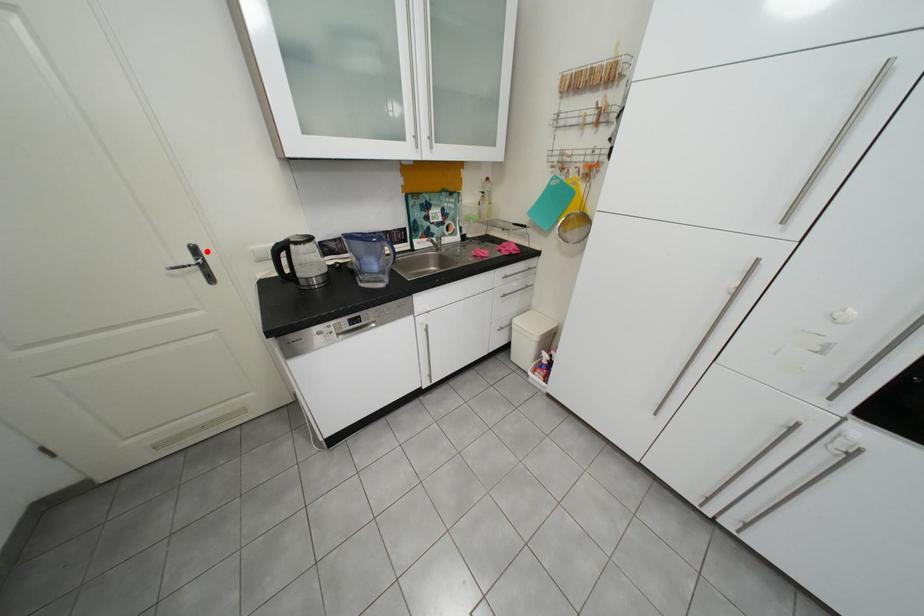
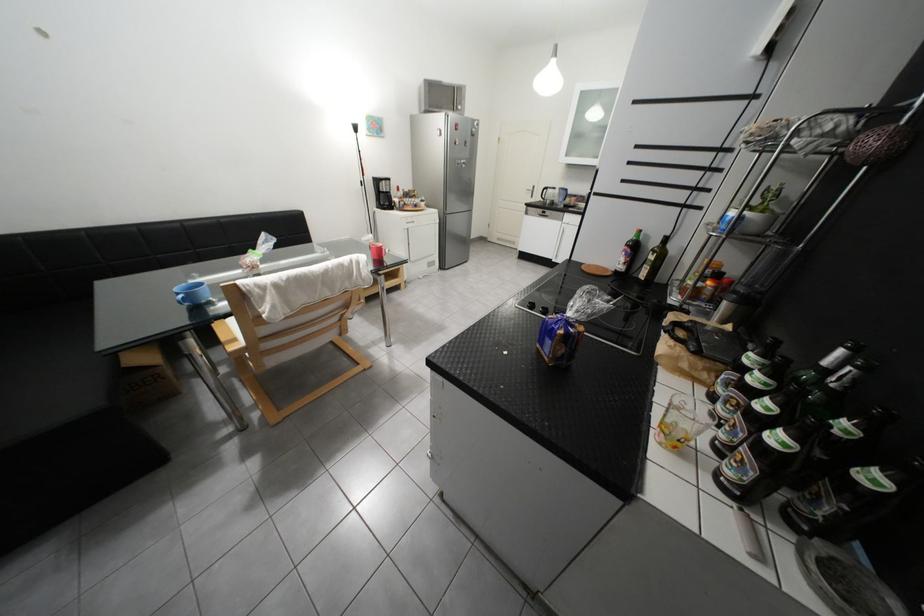
Question: I am providing you with two images of the same scene from different viewpoints. Given a red point in image1, look at the same physical point in image2. Is it:

Choices:
 (A) Closer to the viewpoint
 (B) Farther from the viewpoint

Answer: (A)